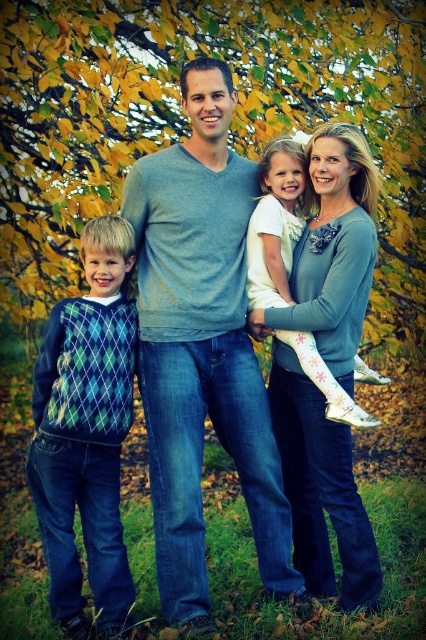
You are a photographer trying to capture a clear shot of both the gray soft sweater at center and the argyle sweater at left. Which one should you focus on first to ensure it appears sharp in the photo?

You should focus on the gray soft sweater at center first because it is closer to the viewer than the argyle sweater at left, so focusing on the closer one ensures it will be sharp.